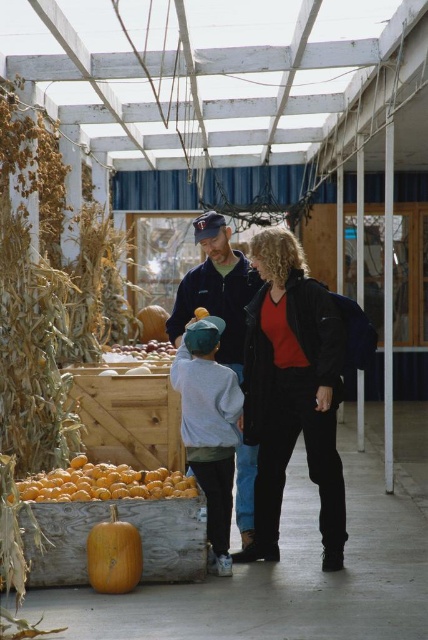
Is black matte jacket at center further to the viewer compared to light gray sweatshirt at center?

No, it is in front of light gray sweatshirt at center.

Does point (341, 332) come behind point (225, 522)?

No, (341, 332) is in front of (225, 522).

You are a GUI agent. You are given a task and a screenshot of the screen. Output one action in this format:
    pyautogui.click(x=<x>, y=<y>)
    Task: Click on the black matte jacket at center
    The height and width of the screenshot is (640, 428).
    Given the screenshot: What is the action you would take?
    pyautogui.click(x=291, y=392)

Is orange matte pumpkins at lower left closer to camera compared to wooden crate at center?

Yes, it is in front of wooden crate at center.

Who is positioned more to the right, orange matte pumpkins at lower left or wooden crate at center?

Positioned to the right is orange matte pumpkins at lower left.

Looking at this image, who is more forward, (193, 490) or (160, 348)?

Point (193, 490)

Find the location of `orange matte pumpkins at lower left`. orange matte pumpkins at lower left is located at coordinates (104, 483).

Is light gray sweatshirt at center positioned behind wooden crate at center?

No, it is in front of wooden crate at center.

Measure the distance between light gray sweatshirt at center and wooden crate at center.

They are 5.46 meters apart.

Does point (226, 396) come behind point (146, 358)?

No, it is in front of (146, 358).

I want to click on light gray sweatshirt at center, so click(x=208, y=426).